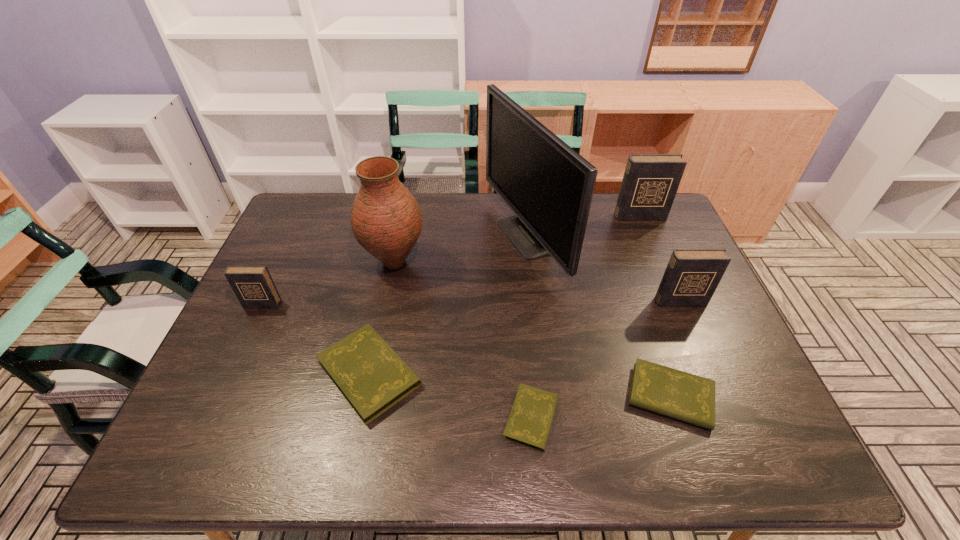
Identify the location of unoccupied position between the tallest object and the biggest green diary. (446, 305).

The image size is (960, 540). In order to click on object that is the sixth closest to the tallest diary in this screenshot , I will do `click(371, 376)`.

Locate an element on the screen. the seventh closest object to the fifth shortest diary is located at coordinates (253, 285).

Choose which diary is the fifth nearest neighbor to the shortest object. Please provide its 2D coordinates. Your answer should be formatted as a tuple, i.e. [(x, y)], where the tuple contains the x and y coordinates of a point satisfying the conditions above.

[(650, 182)]

Identify the location of diary that is the third closest to the third tallest diary. (690, 398).

Select which dark diary appears as the third closest to the fifth diary from right to left. Please provide its 2D coordinates. Your answer should be formatted as a tuple, i.e. [(x, y)], where the tuple contains the x and y coordinates of a point satisfying the conditions above.

[(650, 182)]

Select which dark diary appears as the third closest to the shortest diary. Please provide its 2D coordinates. Your answer should be formatted as a tuple, i.e. [(x, y)], where the tuple contains the x and y coordinates of a point satisfying the conditions above.

[(650, 182)]

I want to click on green diary that is the closest to the tallest object, so click(371, 376).

Where is `green diary that can be found as the second closest to the shortest diary`? Image resolution: width=960 pixels, height=540 pixels. green diary that can be found as the second closest to the shortest diary is located at coordinates [x=371, y=376].

I want to click on vacant position in the image that satisfies the following two spatial constraints: 1. on the front side of the second green diary from left to right; 2. on the left side of the fourth tallest diary, so click(360, 418).